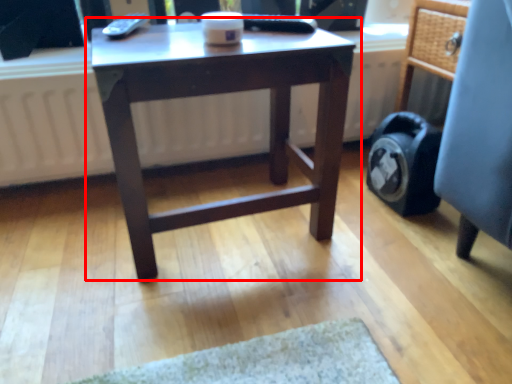
Question: From the image, what is the correct spatial relationship of table (annotated by the red box) in relation to computer chair?

Choices:
 (A) right
 (B) left

Answer: (B)